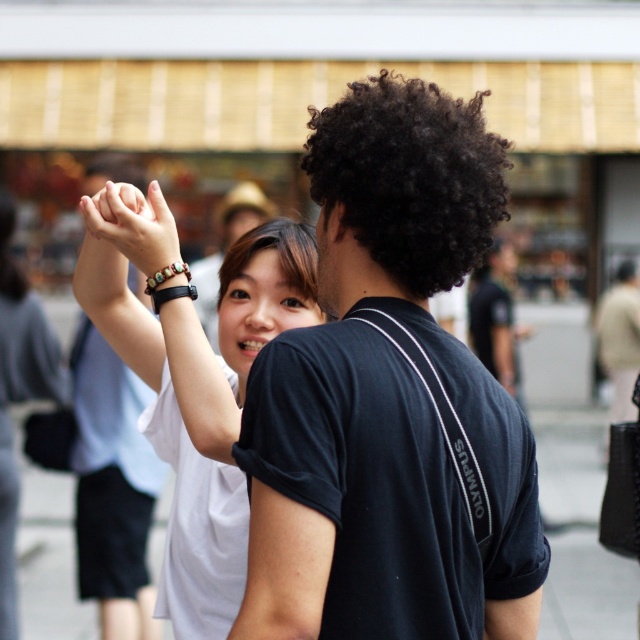
You are standing at the point with coordinates point (0, 499) and want to take a photo of the person holding hands with the person facing away. Which direction should you move to ensure the point (316, 124) is visible in your frame?

Since point (316, 124) is in front of point (0, 499), you should move towards the direction of point (316, 124) to ensure it is visible in your frame.

You are a photographer trying to capture a closeup shot of both the black matte shirt at center and the black curly hair at center in the scene. Given that your camera has a minimum focusing distance of 2 meters, will you be able to take the photo without moving closer?

The distance between the black matte shirt at center and the black curly hair at center is 1.67 meters, which is less than the camera minimum focusing distance of 2 meters. Therefore, you can take the photo without moving closer.